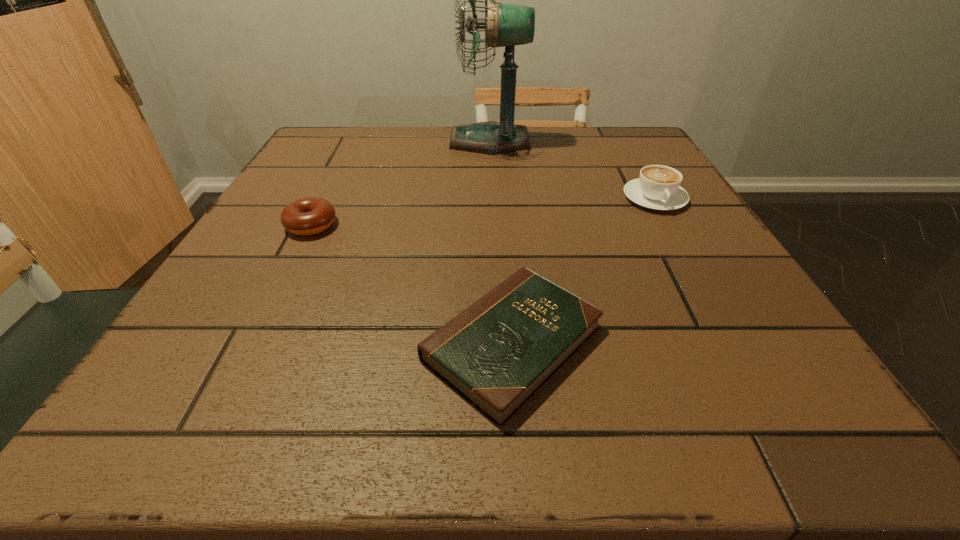
Where is `free spot between the Bible and the tallest object`? This screenshot has height=540, width=960. free spot between the Bible and the tallest object is located at coordinates (501, 242).

I want to click on vacant area between the second shortest object and the nearest object, so coord(412,284).

You are a GUI agent. You are given a task and a screenshot of the screen. Output one action in this format:
    pyautogui.click(x=<x>, y=<y>)
    Task: Click on the vacant region between the leftmost object and the farthest object
    The height and width of the screenshot is (540, 960).
    Given the screenshot: What is the action you would take?
    pyautogui.click(x=400, y=183)

Select which object is the closest to the leftmost object. Please provide its 2D coordinates. Your answer should be formatted as a tuple, i.e. [(x, y)], where the tuple contains the x and y coordinates of a point satisfying the conditions above.

[(497, 353)]

Where is `object that can be found as the second closest to the Bible`? This screenshot has width=960, height=540. object that can be found as the second closest to the Bible is located at coordinates (658, 187).

Image resolution: width=960 pixels, height=540 pixels. Find the location of `free location that satisfies the following two spatial constraints: 1. in front of the tallest object where the wind blows; 2. on the right side of the shortest object`. free location that satisfies the following two spatial constraints: 1. in front of the tallest object where the wind blows; 2. on the right side of the shortest object is located at coordinates 498,343.

Where is `free location that satisfies the following two spatial constraints: 1. on the front side of the third tallest object; 2. on the left side of the nearest object`? free location that satisfies the following two spatial constraints: 1. on the front side of the third tallest object; 2. on the left side of the nearest object is located at coordinates (252, 343).

Locate an element on the screen. vacant region that satisfies the following two spatial constraints: 1. on the front side of the second shortest object; 2. on the left side of the nearest object is located at coordinates [x=252, y=343].

Locate an element on the screen. This screenshot has width=960, height=540. vacant space that satisfies the following two spatial constraints: 1. in front of the farthest object where the wind blows; 2. on the left side of the nearest object is located at coordinates (498, 343).

The width and height of the screenshot is (960, 540). In order to click on vacant region that satisfies the following two spatial constraints: 1. in front of the farthest object where the wind blows; 2. on the front side of the third tallest object in this screenshot , I will do `click(493, 225)`.